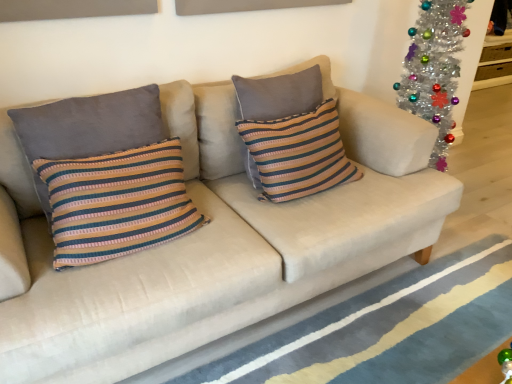
Question: Can you confirm if striped fabric pillow at center, positioned as the 1th pillow in right-to-left order, is smaller than blue striped rug at lower center?

Choices:
 (A) no
 (B) yes

Answer: (A)

Question: Considering the relative positions of striped fabric pillow at center, positioned as the 1th pillow in right-to-left order, and blue striped rug at lower center in the image provided, is striped fabric pillow at center, positioned as the 1th pillow in right-to-left order, to the left of blue striped rug at lower center from the viewer's perspective?

Choices:
 (A) yes
 (B) no

Answer: (A)

Question: From the image's perspective, is striped fabric pillow at center, positioned as the 1th pillow in right-to-left order, over blue striped rug at lower center?

Choices:
 (A) yes
 (B) no

Answer: (A)

Question: Is striped fabric pillow at center, the second pillow positioned from the left, positioned with its back to blue striped rug at lower center?

Choices:
 (A) no
 (B) yes

Answer: (A)

Question: Is striped fabric pillow at center, positioned as the 1th pillow in right-to-left order, located outside blue striped rug at lower center?

Choices:
 (A) no
 (B) yes

Answer: (B)

Question: Is blue striped rug at lower center a part of striped fabric pillow at center, positioned as the 1th pillow in right-to-left order?

Choices:
 (A) yes
 (B) no

Answer: (B)

Question: Can we say blue striped rug at lower center lies outside striped fabric pillow at left, which is the second pillow in right-to-left order?

Choices:
 (A) yes
 (B) no

Answer: (A)

Question: Does blue striped rug at lower center have a greater width compared to striped fabric pillow at left, acting as the first pillow starting from the left?

Choices:
 (A) no
 (B) yes

Answer: (B)

Question: Does blue striped rug at lower center come behind striped fabric pillow at left, acting as the first pillow starting from the left?

Choices:
 (A) no
 (B) yes

Answer: (A)

Question: Does blue striped rug at lower center have a lesser width compared to striped fabric pillow at left, acting as the first pillow starting from the left?

Choices:
 (A) no
 (B) yes

Answer: (A)

Question: Is blue striped rug at lower center to the right of striped fabric pillow at left, acting as the first pillow starting from the left, from the viewer's perspective?

Choices:
 (A) no
 (B) yes

Answer: (B)

Question: From the image's perspective, would you say blue striped rug at lower center is positioned over striped fabric pillow at left, acting as the first pillow starting from the left?

Choices:
 (A) no
 (B) yes

Answer: (A)

Question: Is striped fabric pillow at left, which is the second pillow in right-to-left order, to the right of blue striped rug at lower center from the viewer's perspective?

Choices:
 (A) no
 (B) yes

Answer: (A)